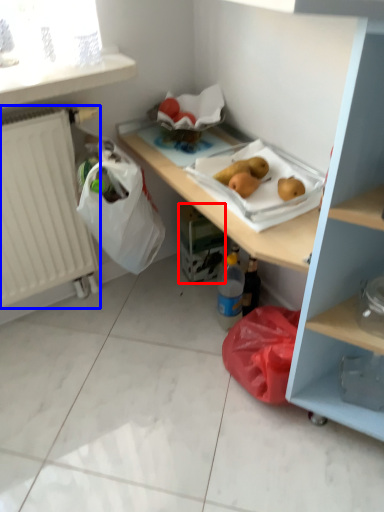
Question: Which object appears farthest to the camera in this image, carton (highlighted by a red box) or radiator (highlighted by a blue box)?

Choices:
 (A) carton
 (B) radiator

Answer: (A)